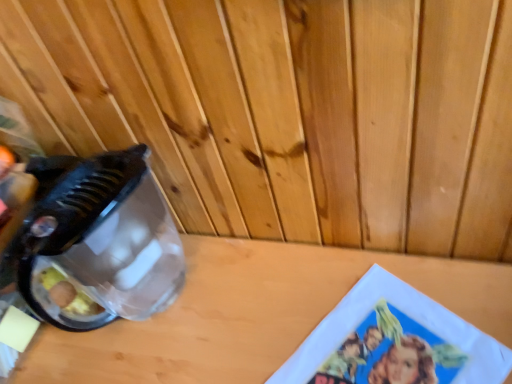
Question: Is transparent plastic blender at left aimed at wooden table at center?

Choices:
 (A) yes
 (B) no

Answer: (B)

Question: Is transparent plastic blender at left at the left side of wooden table at center?

Choices:
 (A) no
 (B) yes

Answer: (B)

Question: Considering the relative sizes of transparent plastic blender at left and wooden table at center in the image provided, is transparent plastic blender at left shorter than wooden table at center?

Choices:
 (A) yes
 (B) no

Answer: (A)

Question: From a real-world perspective, is transparent plastic blender at left physically above wooden table at center?

Choices:
 (A) no
 (B) yes

Answer: (B)

Question: Are transparent plastic blender at left and wooden table at center far apart?

Choices:
 (A) no
 (B) yes

Answer: (A)

Question: Considering the relative sizes of transparent plastic blender at left and wooden table at center in the image provided, is transparent plastic blender at left thinner than wooden table at center?

Choices:
 (A) yes
 (B) no

Answer: (A)

Question: Is wooden table at center in front of transparent plastic blender at left?

Choices:
 (A) yes
 (B) no

Answer: (A)

Question: Is wooden table at center at the right side of transparent plastic blender at left?

Choices:
 (A) yes
 (B) no

Answer: (A)

Question: Could you tell me if wooden table at center is facing transparent plastic blender at left?

Choices:
 (A) no
 (B) yes

Answer: (A)

Question: From a real-world perspective, is wooden table at center positioned under transparent plastic blender at left based on gravity?

Choices:
 (A) no
 (B) yes

Answer: (B)

Question: Are wooden table at center and transparent plastic blender at left far apart?

Choices:
 (A) yes
 (B) no

Answer: (B)

Question: Can you confirm if wooden table at center is taller than transparent plastic blender at left?

Choices:
 (A) no
 (B) yes

Answer: (B)

Question: Is wooden table at center bigger or smaller than transparent plastic blender at left?

Choices:
 (A) small
 (B) big

Answer: (B)